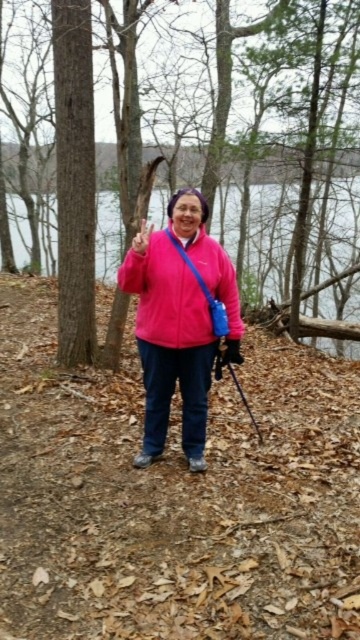
Which is above, transparent water at center or matte pink jacket at center?

transparent water at center is higher up.

Can you confirm if transparent water at center is thinner than matte pink jacket at center?

Incorrect, transparent water at center's width is not less than matte pink jacket at center's.

Where is `transparent water at center`? Image resolution: width=360 pixels, height=640 pixels. transparent water at center is located at coordinates (259, 234).

Who is positioned more to the left, brown wood tree at center or pink matte jacket at center?

From the viewer's perspective, pink matte jacket at center appears more on the left side.

Measure the distance between point (275, 157) and camera.

Point (275, 157) is 12.58 meters away from camera.

You are a GUI agent. You are given a task and a screenshot of the screen. Output one action in this format:
    pyautogui.click(x=<x>, y=<y>)
    Task: Click on the brown wood tree at center
    
    Given the screenshot: What is the action you would take?
    pyautogui.click(x=276, y=84)

Can you confirm if brown wood tree at center is smaller than matte pink jacket at center?

Incorrect, brown wood tree at center is not smaller in size than matte pink jacket at center.

Find the location of a particular element. This screenshot has height=640, width=360. brown wood tree at center is located at coordinates (276, 84).

Where is `brown wood tree at center`? brown wood tree at center is located at coordinates (276, 84).